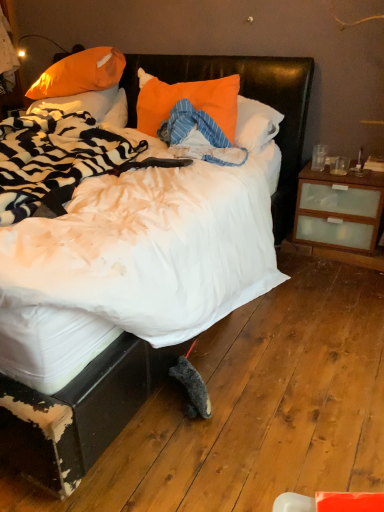
Question: Is orange fabric pillow at upper left, the second pillow viewed from the right, not inside white soft bed at center?

Choices:
 (A) no
 (B) yes

Answer: (A)

Question: Considering the relative sizes of orange fabric pillow at upper left, which appears as the second pillow when viewed from the left, and white soft bed at center in the image provided, is orange fabric pillow at upper left, which appears as the second pillow when viewed from the left, smaller than white soft bed at center?

Choices:
 (A) no
 (B) yes

Answer: (B)

Question: Is orange fabric pillow at upper left, the second pillow viewed from the right, aimed at white soft bed at center?

Choices:
 (A) yes
 (B) no

Answer: (A)

Question: Is the position of orange fabric pillow at upper left, which appears as the second pillow when viewed from the left, less distant than that of white soft bed at center?

Choices:
 (A) yes
 (B) no

Answer: (B)

Question: Is orange fabric pillow at upper left, which appears as the second pillow when viewed from the left, turned away from white soft bed at center?

Choices:
 (A) yes
 (B) no

Answer: (A)

Question: Is orange fabric pillow at upper left, which appears as the second pillow when viewed from the left, thinner than white soft bed at center?

Choices:
 (A) no
 (B) yes

Answer: (B)

Question: Can you confirm if orange fabric pillow at upper left, positioned as the 1th pillow in left-to-right order, is shorter than orange fabric pillow at center, which is the 1th pillow from right to left?

Choices:
 (A) no
 (B) yes

Answer: (B)

Question: Is orange fabric pillow at upper left, the third pillow from the right, in contact with orange fabric pillow at center, the third pillow positioned from the left?

Choices:
 (A) no
 (B) yes

Answer: (A)

Question: From the image's perspective, is orange fabric pillow at upper left, the third pillow from the right, beneath orange fabric pillow at center, which is the 1th pillow from right to left?

Choices:
 (A) yes
 (B) no

Answer: (B)

Question: Does orange fabric pillow at upper left, positioned as the 1th pillow in left-to-right order, come behind orange fabric pillow at center, which is the 1th pillow from right to left?

Choices:
 (A) yes
 (B) no

Answer: (A)

Question: From a real-world perspective, is orange fabric pillow at upper left, the third pillow from the right, under orange fabric pillow at center, the third pillow positioned from the left?

Choices:
 (A) no
 (B) yes

Answer: (B)

Question: Is orange fabric pillow at upper left, the third pillow from the right, thinner than orange fabric pillow at center, which is the 1th pillow from right to left?

Choices:
 (A) yes
 (B) no

Answer: (B)

Question: Can you confirm if white soft bed at center is bigger than orange fabric pillow at upper left, the second pillow viewed from the right?

Choices:
 (A) no
 (B) yes

Answer: (B)